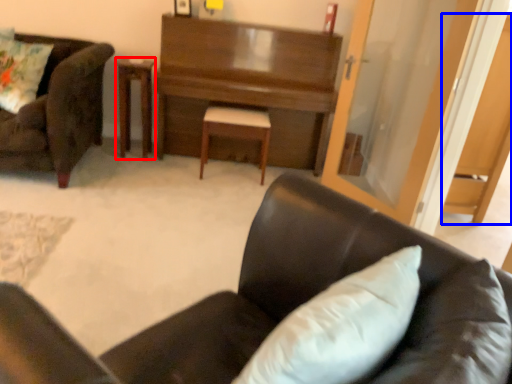
Question: Which object appears closest to the camera in this image, table (highlighted by a red box) or dark (highlighted by a blue box)?

Choices:
 (A) table
 (B) dark

Answer: (B)